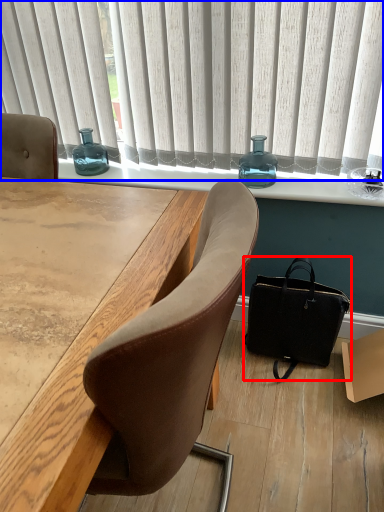
Question: Which object appears closest to the camera in this image, handbag (highlighted by a red box) or curtain (highlighted by a blue box)?

Choices:
 (A) handbag
 (B) curtain

Answer: (B)